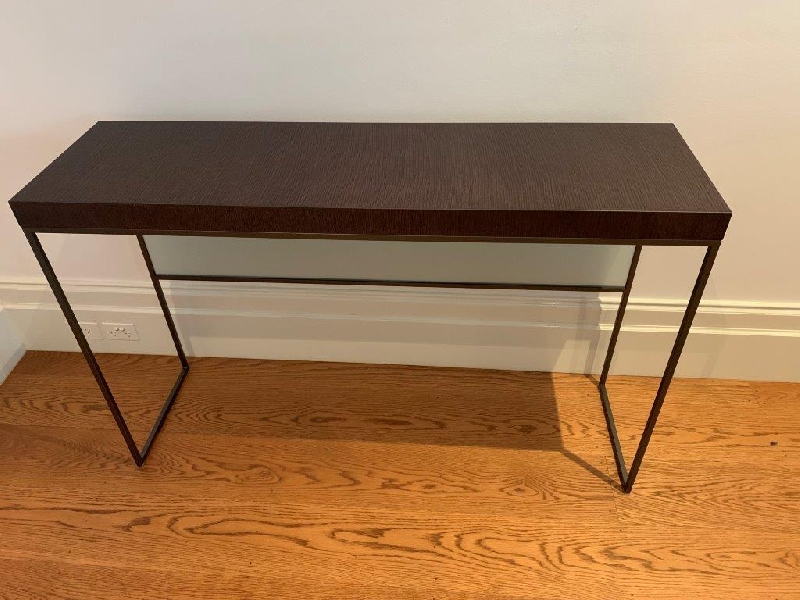
Identify the location of shadow of table. (278, 252).